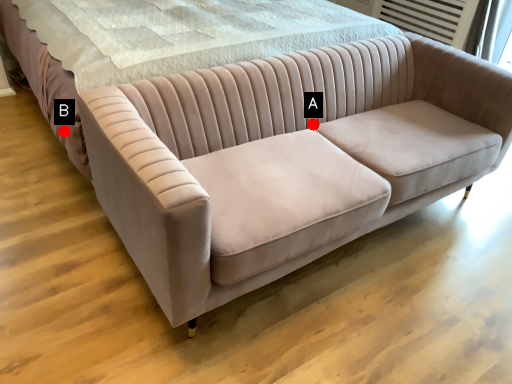
Question: Two points are circled on the image, labeled by A and B beside each circle. Among these points, which one is farthest from the camera?

Choices:
 (A) A is further
 (B) B is further

Answer: (A)